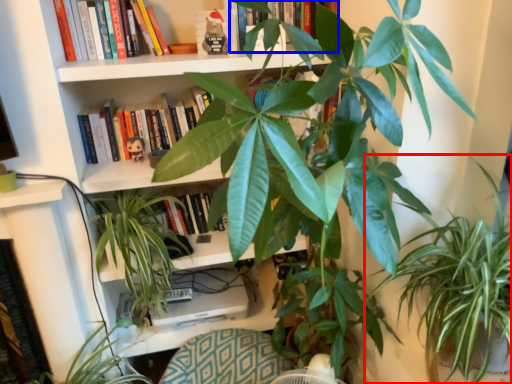
Question: Among these objects, which one is farthest to the camera, houseplant (highlighted by a red box) or book (highlighted by a blue box)?

Choices:
 (A) houseplant
 (B) book

Answer: (B)